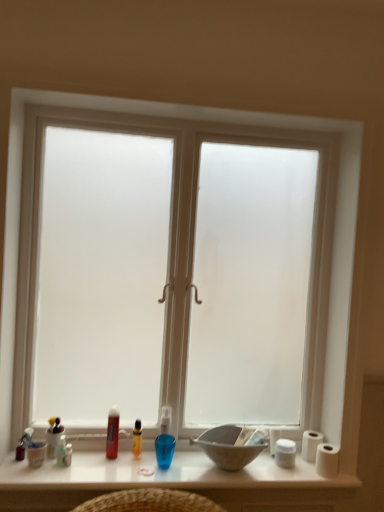
You are a GUI agent. You are given a task and a screenshot of the screen. Output one action in this format:
    pyautogui.click(x=<x>, y=<y>)
    Task: Click on the empty space that is in between translucent plastic container at lower left, which is counted as the fifth toiletry, starting from the right, and translucent plastic bottle at center, marked as the fifth toiletry in a left-to-right arrangement
    The image size is (384, 512).
    Given the screenshot: What is the action you would take?
    pyautogui.click(x=93, y=455)